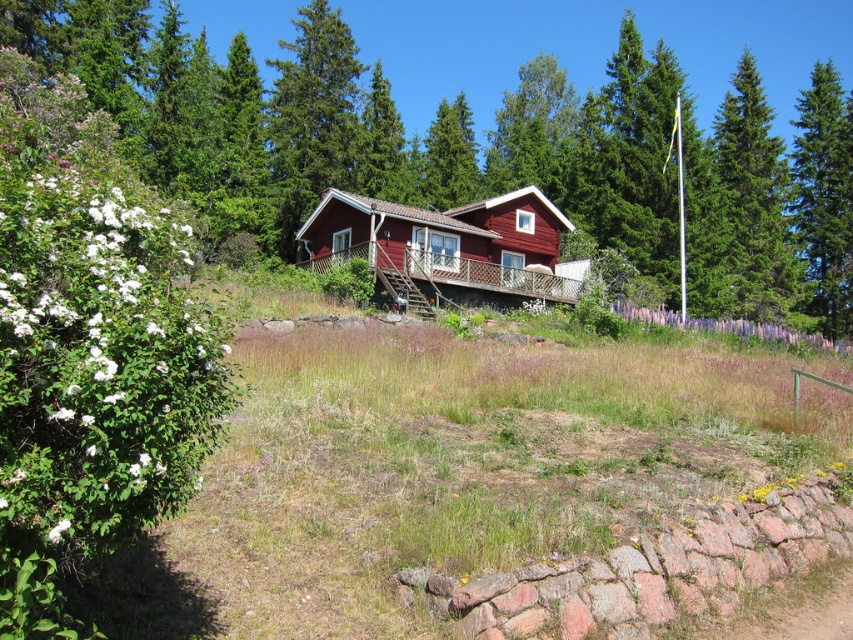
Question: Where is green fir tree at upper right located in relation to green coniferous tree at right in the image?

Choices:
 (A) right
 (B) left

Answer: (B)

Question: In this image, where is green fir tree at upper right located relative to purple soft grass at center?

Choices:
 (A) below
 (B) above

Answer: (B)

Question: Among these points, which one is nearest to the camera?

Choices:
 (A) (442, 230)
 (B) (712, 218)
 (C) (790, 340)

Answer: (C)

Question: Is green coniferous tree at right to the left of purple soft grass at center from the viewer's perspective?

Choices:
 (A) yes
 (B) no

Answer: (B)

Question: Which point is farther from the camera taking this photo?

Choices:
 (A) (746, 83)
 (B) (315, 257)

Answer: (A)

Question: Which point is farther to the camera?

Choices:
 (A) purple soft grass at center
 (B) green fir tree at upper right
 (C) matte red cabin at center

Answer: (B)